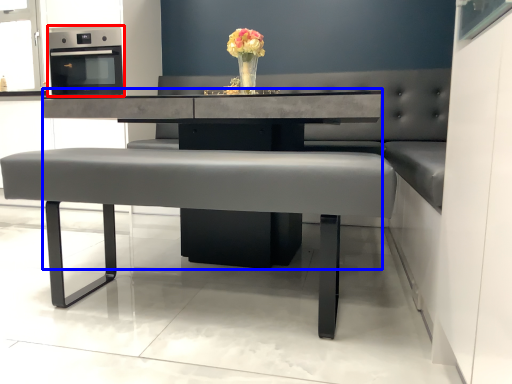
Question: Among these objects, which one is nearest to the camera, appliance (highlighted by a red box) or round table (highlighted by a blue box)?

Choices:
 (A) appliance
 (B) round table

Answer: (B)